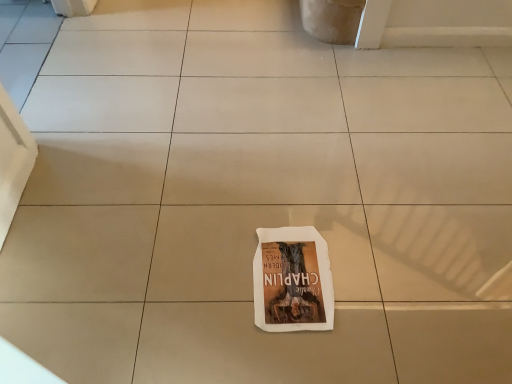
You are a GUI agent. You are given a task and a screenshot of the screen. Output one action in this format:
    pyautogui.click(x=<x>, y=<y>)
    Task: Click on the free spot below white paper magazine at center (from a real-world perspective)
    
    Given the screenshot: What is the action you would take?
    pyautogui.click(x=292, y=272)